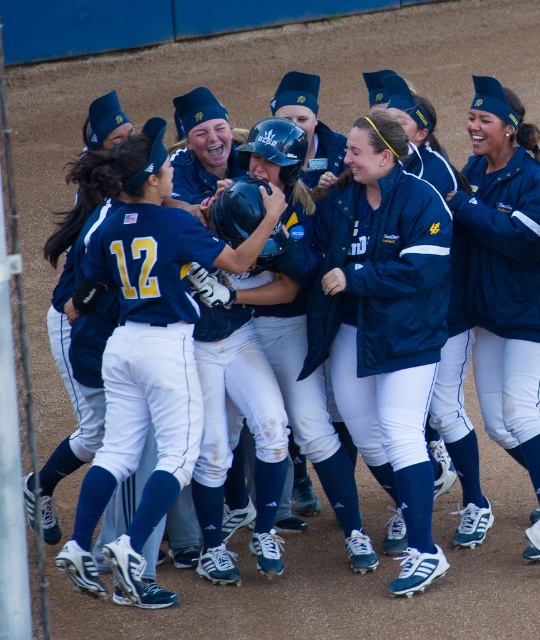
Which is behind, point (96, 520) or point (531, 148)?

The point (531, 148) is more distant.

Does point (187, 346) come behind point (489, 163)?

No, (187, 346) is closer to viewer.

Does point (138, 221) come farther from viewer compared to point (500, 364)?

No, (138, 221) is in front of (500, 364).

The image size is (540, 640). In order to click on navy blue jersey at center in this screenshot , I will do `click(148, 355)`.

Does blue matte jacket at center come behind navy blue jersey at center?

Yes.

Is point (428, 403) closer to viewer compared to point (157, 216)?

No, (428, 403) is behind (157, 216).

The image size is (540, 640). Find the location of `blue matte jacket at center`. blue matte jacket at center is located at coordinates (384, 321).

Where is `blue matte jacket at center`? blue matte jacket at center is located at coordinates (384, 321).

Is point (333, 212) more distant than point (471, 269)?

No, it is not.

Locate an element on the screen. blue matte jacket at center is located at coordinates (384, 321).